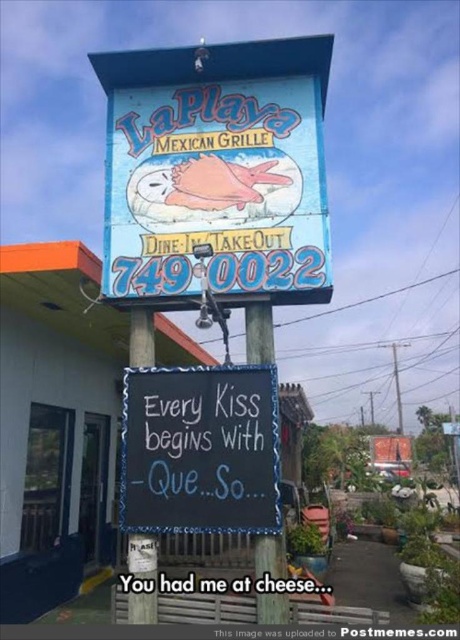
Can you confirm if black chalkboard at center is positioned to the right of blue wooden signpost at center?

Incorrect, black chalkboard at center is not on the right side of blue wooden signpost at center.

Does black chalkboard at center lie in front of blue wooden signpost at center?

No, black chalkboard at center is further to the viewer.

Who is more distant from viewer, (202, 406) or (266, 310)?

The point (266, 310) is behind.

The image size is (460, 640). Find the location of `black chalkboard at center`. black chalkboard at center is located at coordinates (200, 451).

Is black chalkboard at center below wooden signpost at center?

Actually, black chalkboard at center is above wooden signpost at center.

Is black chalkboard at center shorter than wooden signpost at center?

No, black chalkboard at center is not shorter than wooden signpost at center.

Image resolution: width=460 pixels, height=640 pixels. What do you see at coordinates (200, 451) in the screenshot?
I see `black chalkboard at center` at bounding box center [200, 451].

Find the location of a particular element. black chalkboard at center is located at coordinates (200, 451).

Is blue wooden signpost at center further to the viewer compared to wooden signpost at center?

No, it is in front of wooden signpost at center.

Does blue wooden signpost at center have a smaller size compared to wooden signpost at center?

No, blue wooden signpost at center is not smaller than wooden signpost at center.

Which is in front, point (263, 330) or point (142, 557)?

Point (142, 557) is more forward.

At what (x,y) coordinates should I click in order to perform the action: click on blue wooden signpost at center. Please return your answer as a coordinate pair (x, y). Looking at the image, I should click on (258, 333).